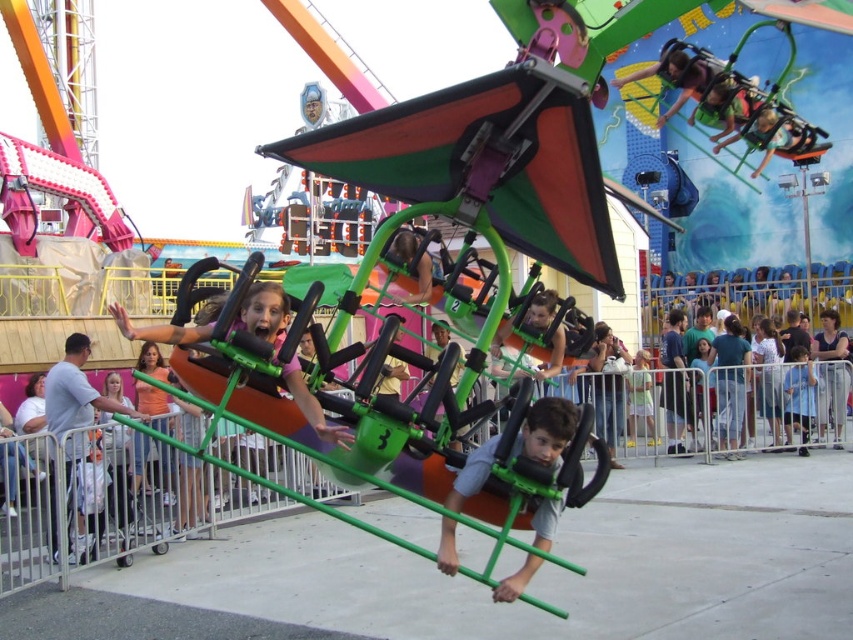
Question: Which point is closer to the camera?

Choices:
 (A) light blue shirt at left
 (B) gray fabric shirt at center

Answer: (B)

Question: In this image, where is gray fabric shirt at center located relative to light blue shirt at left?

Choices:
 (A) right
 (B) left

Answer: (A)

Question: Does gray fabric shirt at center have a larger size compared to light blue shirt at left?

Choices:
 (A) no
 (B) yes

Answer: (A)

Question: Which of the following is the closest to the observer?

Choices:
 (A) gray fabric shirt at center
 (B) blue fabric shirt at lower right

Answer: (A)

Question: Considering the real-world distances, which object is farthest from the gray fabric shirt at center?

Choices:
 (A) blue fabric shirt at lower right
 (B) light blue shirt at left

Answer: (A)

Question: Does light blue shirt at left lie in front of blue fabric shirt at lower right?

Choices:
 (A) no
 (B) yes

Answer: (B)